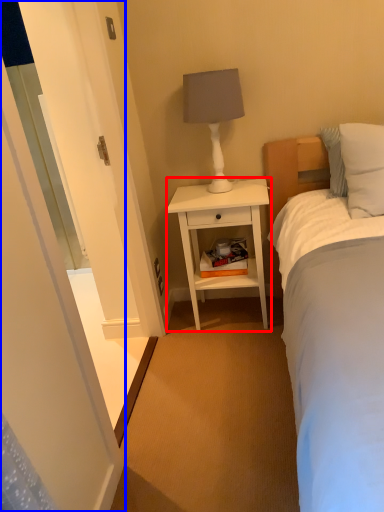
Question: Which object appears closest to the camera in this image, nightstand (highlighted by a red box) or screen door (highlighted by a blue box)?

Choices:
 (A) nightstand
 (B) screen door

Answer: (B)